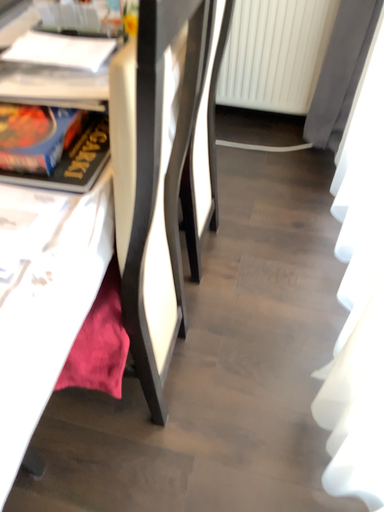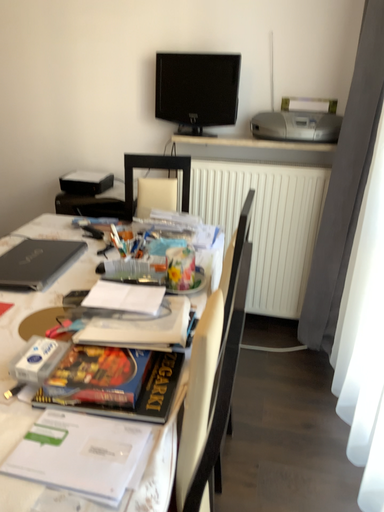
Question: Which way did the camera rotate in the video?

Choices:
 (A) rotated downward
 (B) rotated upward

Answer: (B)